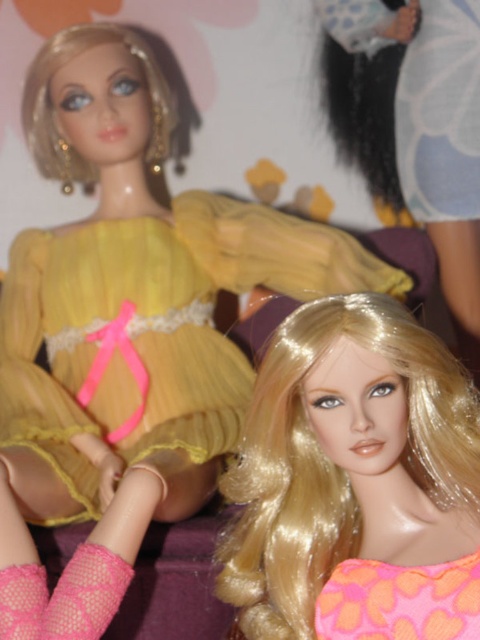
You are a toy organizer trying to place the shiny blonde wig at center and the pink fabric dress at lower right into storage boxes. The box for the wig can only accommodate items up to the size of the dress. Will the wig fit into the box?

The shiny blonde wig at center is larger in size than the pink fabric dress at lower right, so it will not fit into the box designed for the dress.

You are a photographer trying to capture a closeup of the shiny blonde wig at center. Based on the coordinates provided, where should you position your camera to ensure the wig is centered in the frame?

The shiny blonde wig at center is located at coordinates point [356,483], so positioning the camera to align the frame center with these coordinates will ensure the wig is centered in the photo.